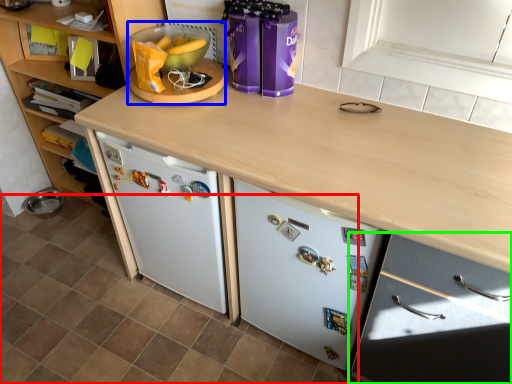
Question: Estimate the real-world distances between objects in this image. Which object is closer to tile (highlighted by a red box), appliance (highlighted by a blue box) or cabinetry (highlighted by a green box)?

Choices:
 (A) appliance
 (B) cabinetry

Answer: (B)